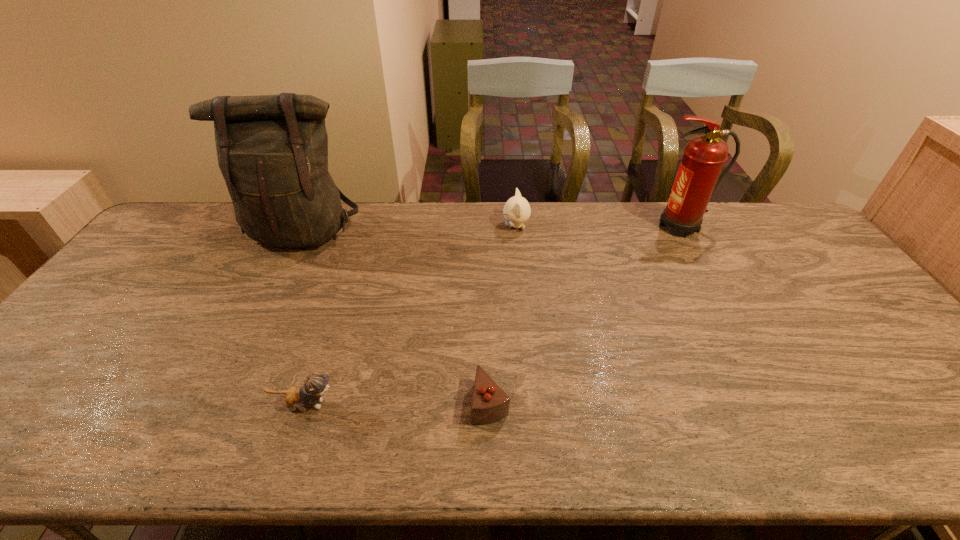
You are a GUI agent. You are given a task and a screenshot of the screen. Output one action in this format:
    pyautogui.click(x=<x>, y=<y>)
    Task: Click on the free point that satisfies the following two spatial constraints: 1. on the open flap of the tallest object; 2. on the left side of the shortest object
    The height and width of the screenshot is (540, 960).
    Given the screenshot: What is the action you would take?
    pyautogui.click(x=220, y=402)

Image resolution: width=960 pixels, height=540 pixels. Identify the location of blank area in the image that satisfies the following two spatial constraints: 1. on the face of the farther kitten; 2. on the open flap of the tallest object. (516, 232).